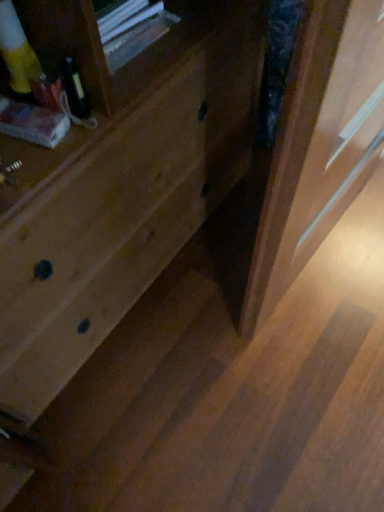
Question: Is wooden screen door at right oriented towards natural wood drawer at center?

Choices:
 (A) no
 (B) yes

Answer: (A)

Question: Can natural wood drawer at center be found inside wooden screen door at right?

Choices:
 (A) yes
 (B) no

Answer: (B)

Question: Does wooden screen door at right appear on the left side of natural wood drawer at center?

Choices:
 (A) no
 (B) yes

Answer: (A)

Question: Is wooden screen door at right bigger than natural wood drawer at center?

Choices:
 (A) no
 (B) yes

Answer: (A)

Question: From the image's perspective, does wooden screen door at right appear lower than natural wood drawer at center?

Choices:
 (A) no
 (B) yes

Answer: (B)

Question: Considering the relative sizes of wooden screen door at right and natural wood drawer at center in the image provided, is wooden screen door at right thinner than natural wood drawer at center?

Choices:
 (A) no
 (B) yes

Answer: (B)

Question: Is natural wood drawer at center with wooden screen door at right?

Choices:
 (A) yes
 (B) no

Answer: (B)

Question: Is natural wood drawer at center positioned behind wooden screen door at right?

Choices:
 (A) yes
 (B) no

Answer: (B)

Question: From a real-world perspective, is natural wood drawer at center on top of wooden screen door at right?

Choices:
 (A) yes
 (B) no

Answer: (A)

Question: Does natural wood drawer at center appear on the right side of wooden screen door at right?

Choices:
 (A) yes
 (B) no

Answer: (B)

Question: From the image's perspective, does natural wood drawer at center appear lower than wooden screen door at right?

Choices:
 (A) yes
 (B) no

Answer: (B)

Question: Could you tell me if natural wood drawer at center is facing wooden screen door at right?

Choices:
 (A) no
 (B) yes

Answer: (B)

Question: Is natural wood drawer at center wider or thinner than wooden screen door at right?

Choices:
 (A) thin
 (B) wide

Answer: (B)